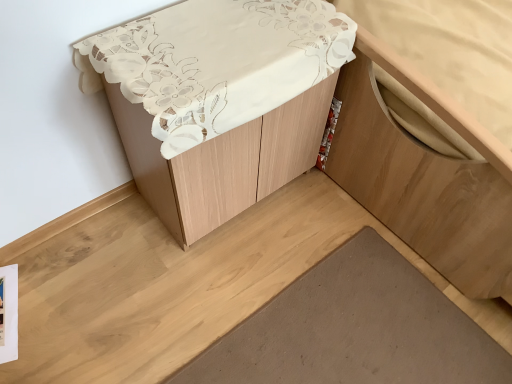
You are a GUI agent. You are given a task and a screenshot of the screen. Output one action in this format:
    pyautogui.click(x=<x>, y=<y>)
    Task: Click on the free space to the left of brown matte wood plank at lower center
    The width and height of the screenshot is (512, 384).
    Given the screenshot: What is the action you would take?
    pyautogui.click(x=140, y=296)